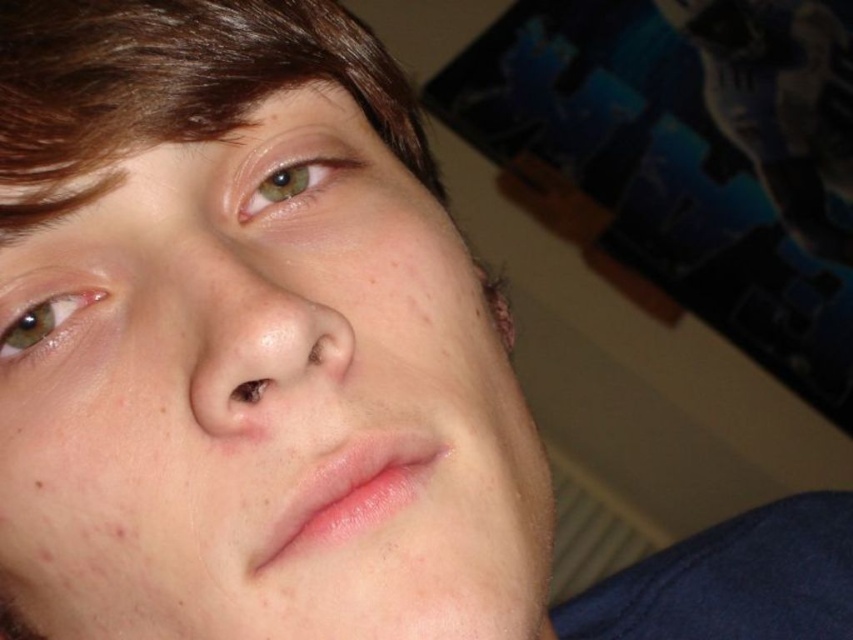
Does smooth skin face at center come in front of green matte eye at upper left?

Yes, it is in front of green matte eye at upper left.

How distant is smooth skin face at center from green matte eye at upper left?

smooth skin face at center and green matte eye at upper left are 2.76 inches apart.

Between point (517, 536) and point (326, 173), which one is positioned in front?

Point (517, 536)

The width and height of the screenshot is (853, 640). I want to click on smooth skin face at center, so click(267, 408).

Is green matte eye at upper left shorter than brown matte eye at lower left?

No.

Is point (293, 176) farther from camera compared to point (7, 349)?

Yes.

Image resolution: width=853 pixels, height=640 pixels. I want to click on green matte eye at upper left, so click(x=296, y=177).

Is smooth skin face at center positioned in front of brown matte eye at lower left?

Yes, smooth skin face at center is in front of brown matte eye at lower left.

Does point (186, 480) come farther from viewer compared to point (16, 320)?

That is False.

Find the location of a particular element. smooth skin face at center is located at coordinates (267, 408).